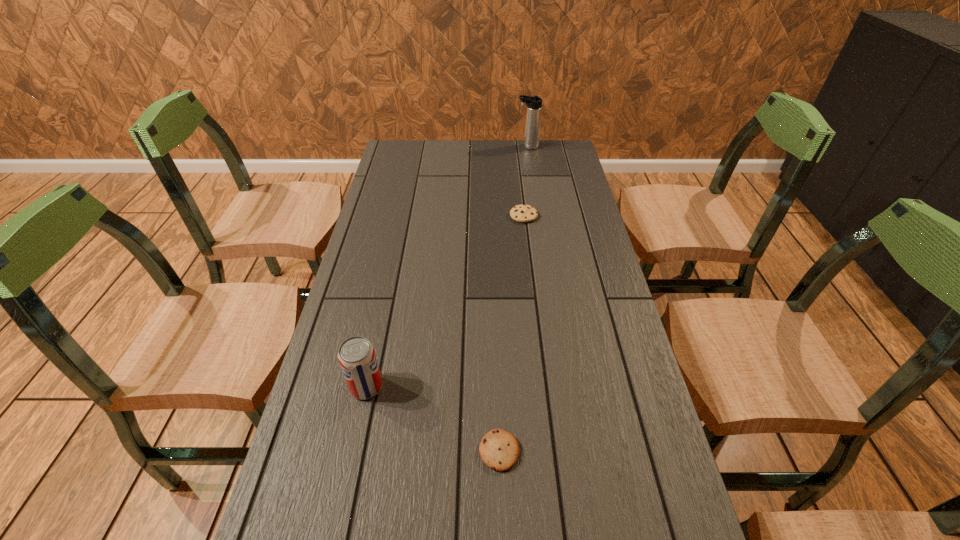
Locate an element on the screen. Image resolution: width=960 pixels, height=540 pixels. blank space located on the handle side of the thermos bottle is located at coordinates (429, 147).

Find the location of a particular element. The image size is (960, 540). free space located on the back of the leftmost object is located at coordinates (378, 329).

Find the location of a particular element. free region located 0.350m on the back of the right cookie is located at coordinates pos(516,157).

At what (x,y) coordinates should I click in order to perform the action: click on vacant space situated on the back of the nearest object. Please return your answer as a coordinate pair (x, y). This screenshot has height=540, width=960. Looking at the image, I should click on (497, 382).

The height and width of the screenshot is (540, 960). In order to click on object at the far edge in this screenshot , I will do `click(534, 104)`.

Image resolution: width=960 pixels, height=540 pixels. In order to click on object present at the left edge in this screenshot , I will do `click(356, 355)`.

The width and height of the screenshot is (960, 540). I want to click on object that is positioned at the right edge, so click(x=534, y=104).

Find the location of `object that is positioned at the far right corner`. object that is positioned at the far right corner is located at coordinates click(x=534, y=104).

At what (x,y) coordinates should I click in order to perform the action: click on vacant space at the far edge. Please return your answer as a coordinate pair (x, y). The image size is (960, 540). Looking at the image, I should click on (461, 155).

Where is `vacant space at the left edge`? vacant space at the left edge is located at coordinates (276, 534).